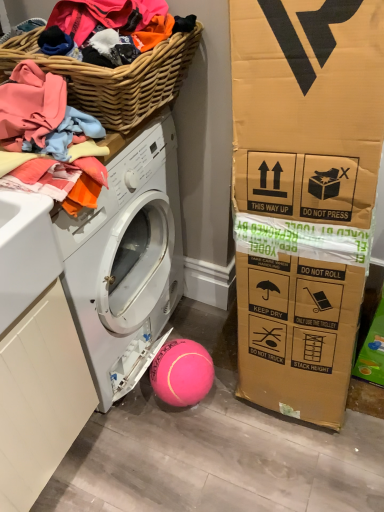
Question: Would you say soft cotton clothes at upper left is inside or outside white matte washing machine at lower left?

Choices:
 (A) inside
 (B) outside

Answer: (B)

Question: In the image, is soft cotton clothes at upper left positioned in front of or behind white matte washing machine at lower left?

Choices:
 (A) behind
 (B) front

Answer: (B)

Question: Estimate the real-world distances between objects in this image. Which object is farther from the white matte washing machine at lower left?

Choices:
 (A) pink rubber ball at lower center
 (B) soft cotton clothes at upper left
 (C) woven wood basket at upper left

Answer: (C)

Question: Which is farther from the soft cotton clothes at upper left?

Choices:
 (A) white matte washing machine at lower left
 (B) woven wood basket at upper left
 (C) pink rubber ball at lower center

Answer: (C)